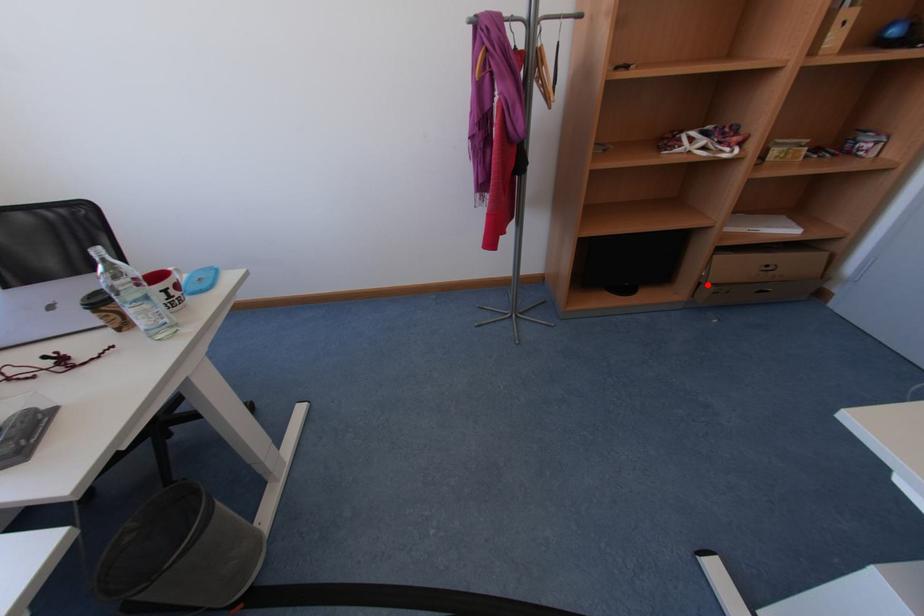
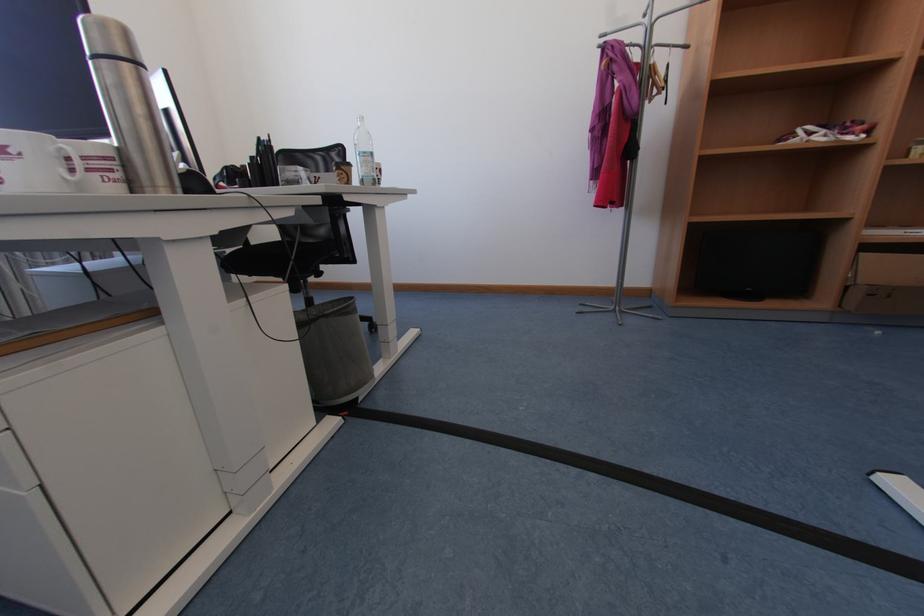
Locate, in the second image, the point that corresponds to the highlighted location in the first image.

(855, 289)